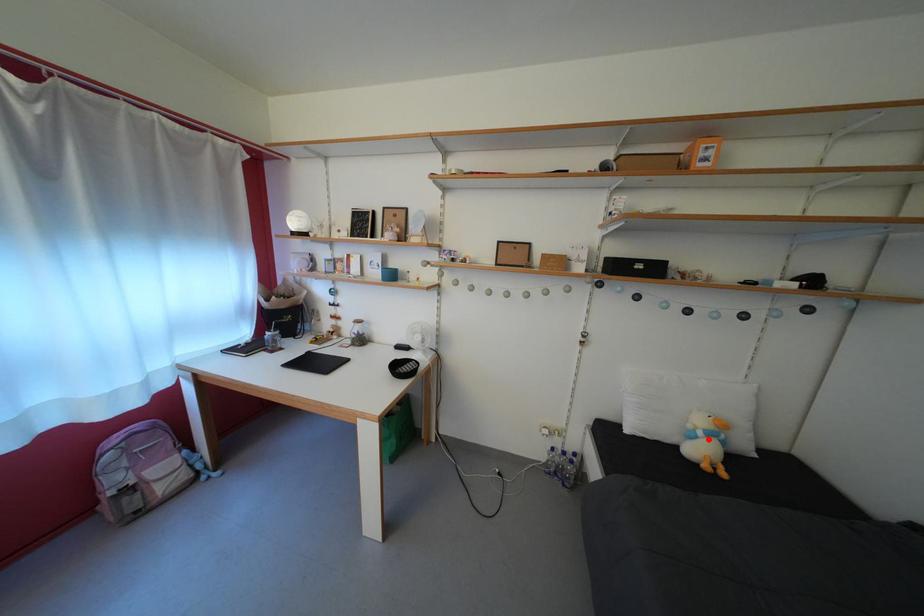
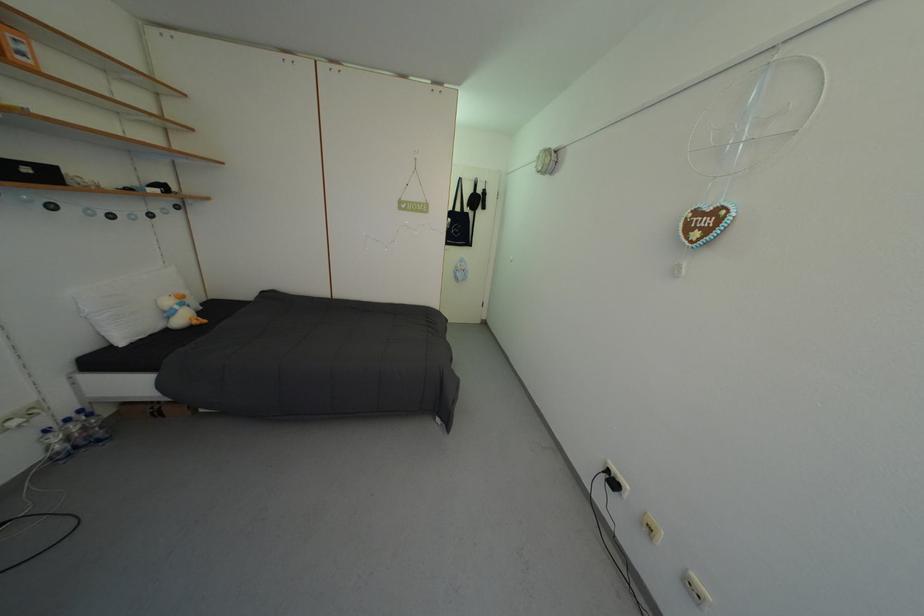
Question: I am providing you with two images of the same scene from different viewpoints. Given a red point in image1, look at the same physical point in image2. Is it:

Choices:
 (A) Closer to the viewpoint
 (B) Farther from the viewpoint

Answer: (A)